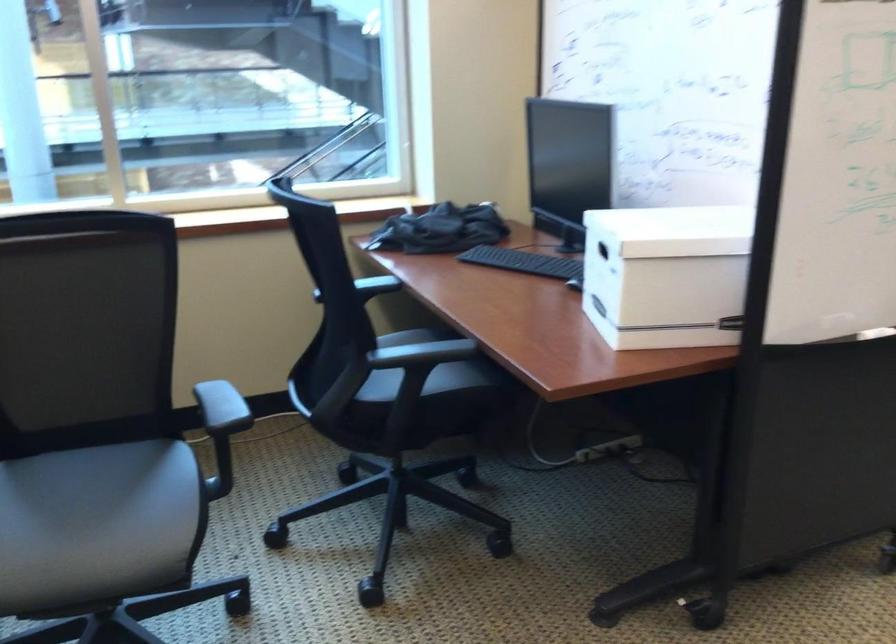
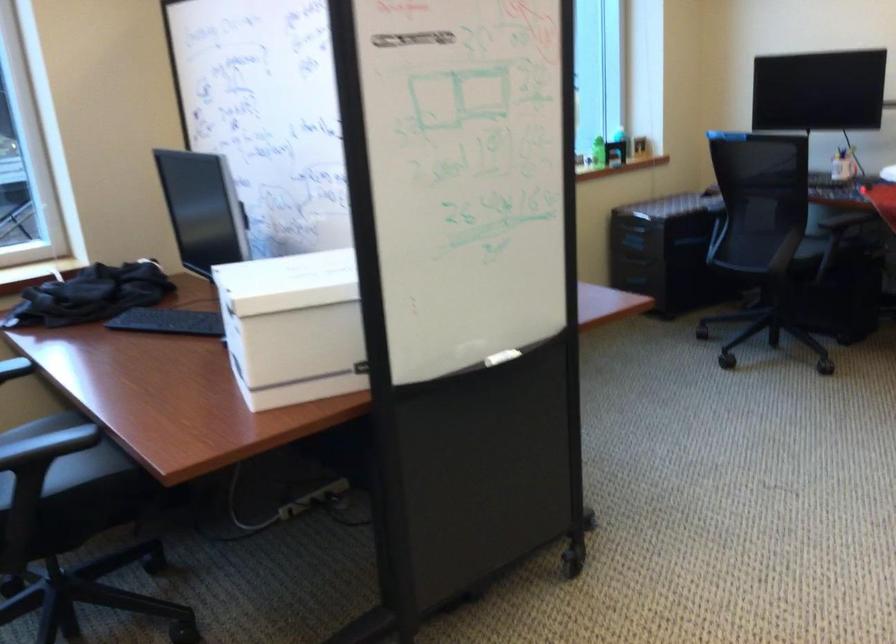
The point at (665,276) is marked in the first image. Where is the corresponding point in the second image?

(293, 327)